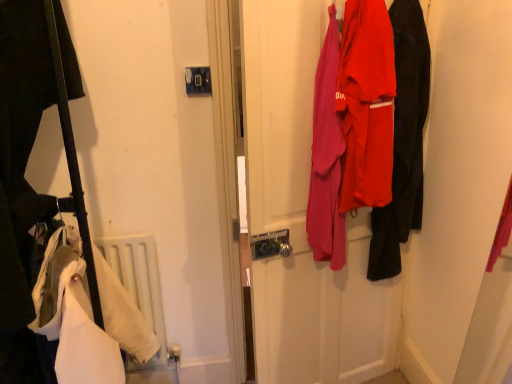
Question: Is the depth of white matte radiator at lower left greater than that of white fabric at left?

Choices:
 (A) yes
 (B) no

Answer: (A)

Question: Is white matte radiator at lower left smaller than white fabric at left?

Choices:
 (A) yes
 (B) no

Answer: (A)

Question: Is white matte radiator at lower left with white fabric at left?

Choices:
 (A) yes
 (B) no

Answer: (B)

Question: From a real-world perspective, is white matte radiator at lower left positioned over white fabric at left based on gravity?

Choices:
 (A) yes
 (B) no

Answer: (B)

Question: Is white matte radiator at lower left taller than white fabric at left?

Choices:
 (A) no
 (B) yes

Answer: (A)

Question: Does white matte radiator at lower left have a greater width compared to white fabric at left?

Choices:
 (A) yes
 (B) no

Answer: (B)

Question: Does matte black jacket at right have a greater height compared to matte fabric coats at center?

Choices:
 (A) no
 (B) yes

Answer: (A)

Question: Could you tell me if matte black jacket at right is facing matte fabric coats at center?

Choices:
 (A) yes
 (B) no

Answer: (A)

Question: Can you see matte black jacket at right touching matte fabric coats at center?

Choices:
 (A) yes
 (B) no

Answer: (B)

Question: Would you say matte fabric coats at center is part of matte black jacket at right's contents?

Choices:
 (A) no
 (B) yes

Answer: (A)

Question: Can you confirm if matte black jacket at right is thinner than matte fabric coats at center?

Choices:
 (A) yes
 (B) no

Answer: (B)

Question: From the image's perspective, is matte black jacket at right located beneath matte fabric coats at center?

Choices:
 (A) yes
 (B) no

Answer: (B)

Question: Is matte black jacket at right aimed at white matte radiator at lower left?

Choices:
 (A) no
 (B) yes

Answer: (A)